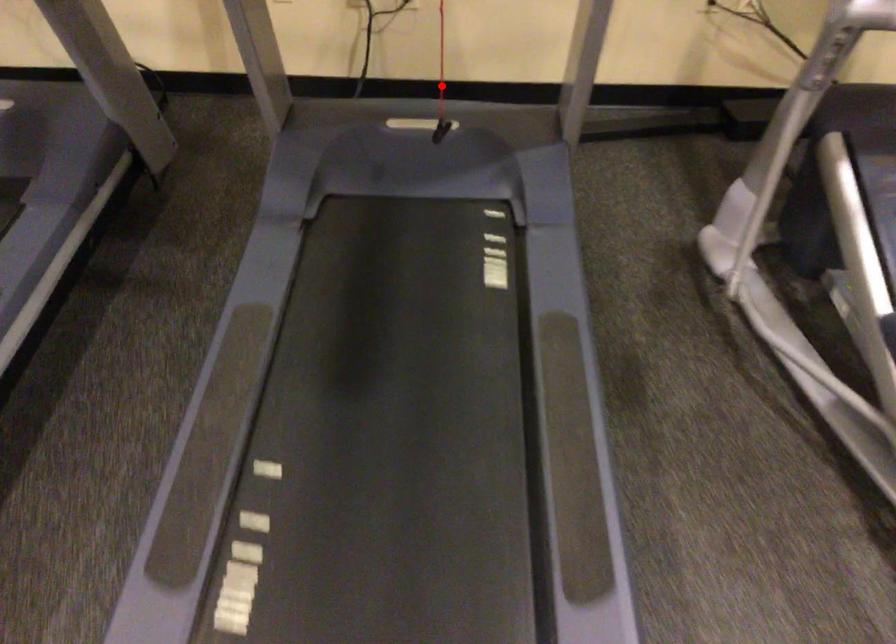
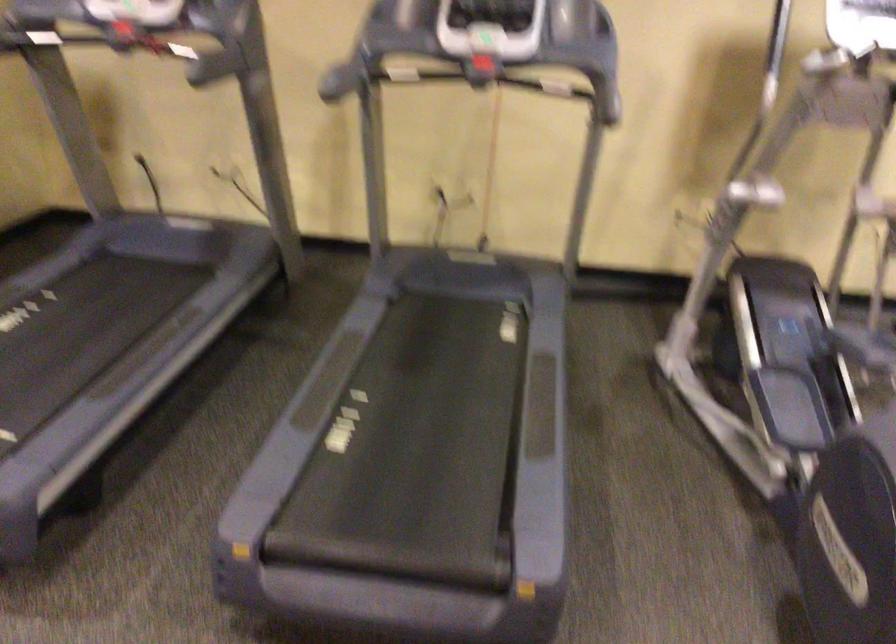
Question: I am providing you with two images of the same scene from different viewpoints. A red point is marked on the first image. At the location where the point appears in image 1, is it still visible in image 2?

Choices:
 (A) Yes
 (B) No

Answer: (B)